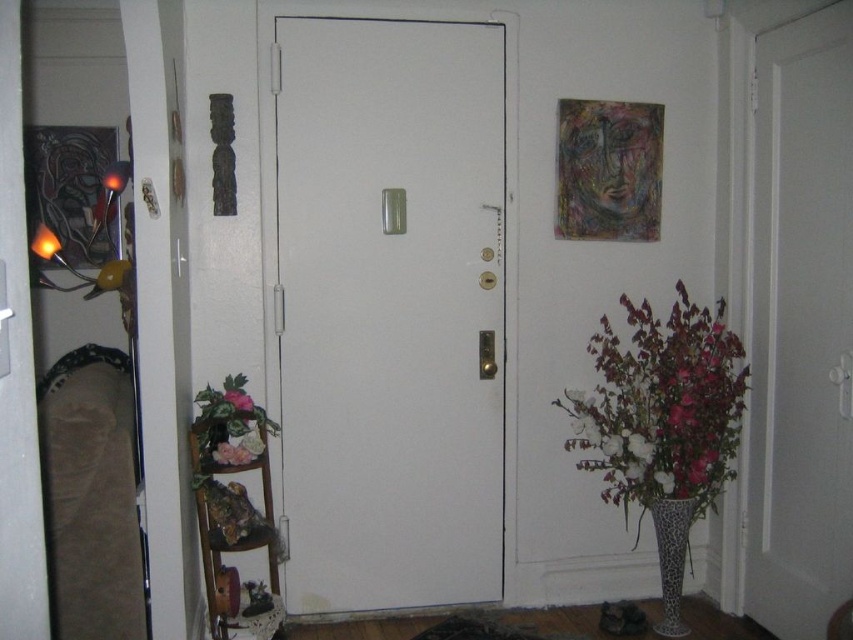
Question: Can you confirm if pink matte flower at center is smaller than white matte vase at lower right?

Choices:
 (A) no
 (B) yes

Answer: (A)

Question: Is white matte door at center closer to camera compared to leopard print vase at lower right?

Choices:
 (A) yes
 (B) no

Answer: (A)

Question: Which point is farther from the camera taking this photo?

Choices:
 (A) (474, 138)
 (B) (698, 424)
 (C) (669, 598)

Answer: (A)

Question: From the image, what is the correct spatial relationship of floral bouquet at right in relation to white matte vase at lower right?

Choices:
 (A) left
 (B) right

Answer: (A)

Question: Which of these objects is positioned closest to the pink matte flower at center?

Choices:
 (A) white matte door at center
 (B) floral bouquet at right

Answer: (A)

Question: Which is farther from the pink matte flower at center?

Choices:
 (A) floral bouquet at right
 (B) leopard print vase at lower right
 (C) white matte vase at lower right

Answer: (B)